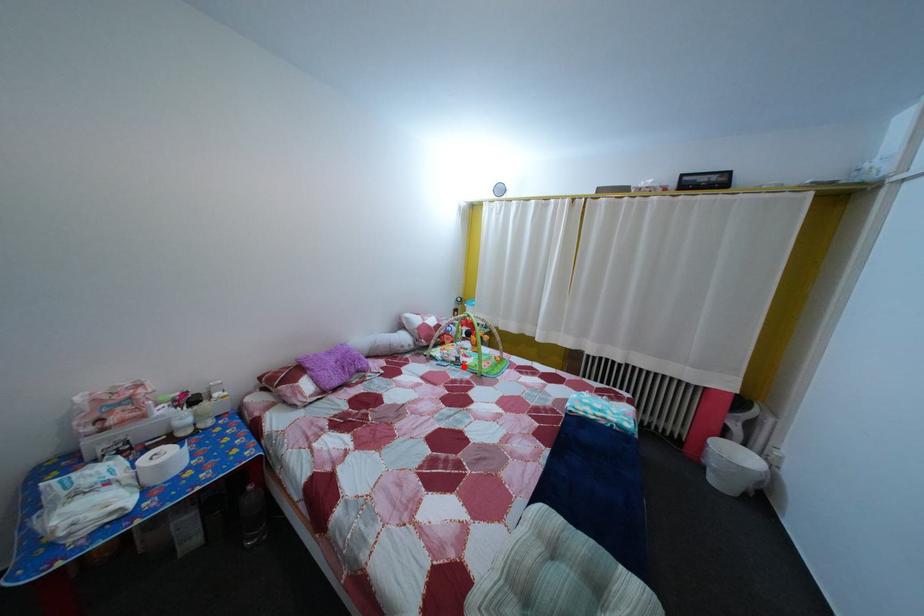
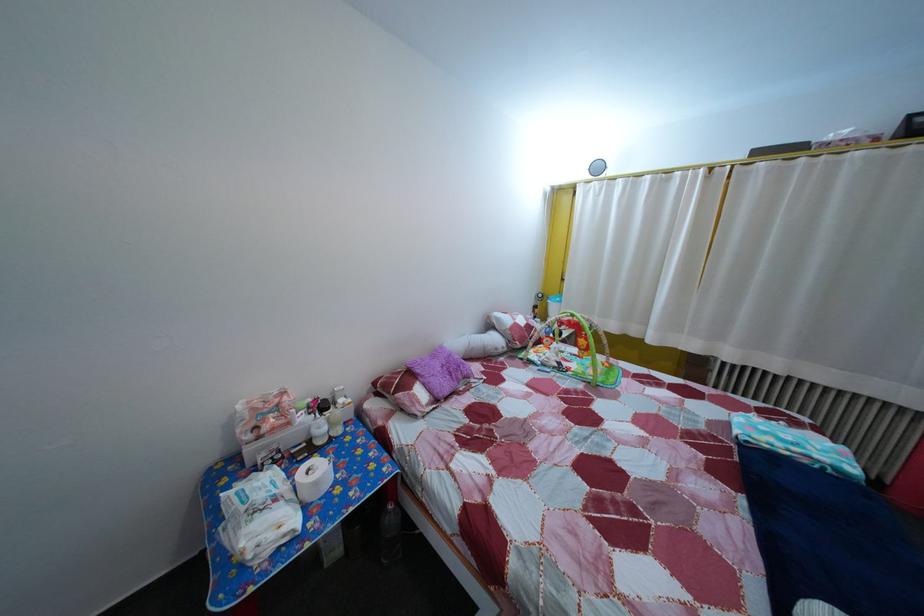
Locate, in the second image, the point that corresponds to the highlighted location in the first image.

(565, 371)